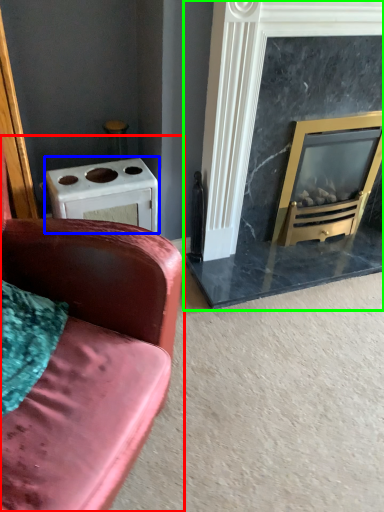
Question: Considering the real-world distances, which object is farthest from studio couch (highlighted by a red box)? appliance (highlighted by a blue box) or fireplace (highlighted by a green box)?

Choices:
 (A) appliance
 (B) fireplace

Answer: (B)